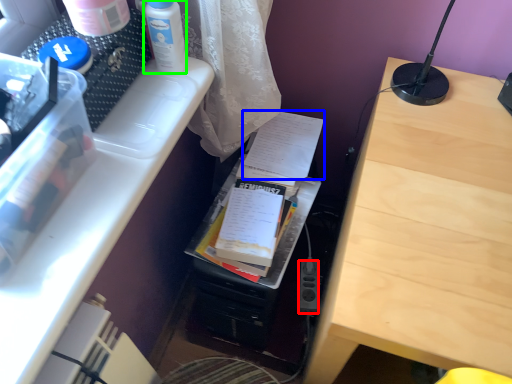
Question: Which is farther away from power plugs and sockets (highlighted by a red box)? document (highlighted by a blue box) or bottle (highlighted by a green box)?

Choices:
 (A) document
 (B) bottle

Answer: (B)